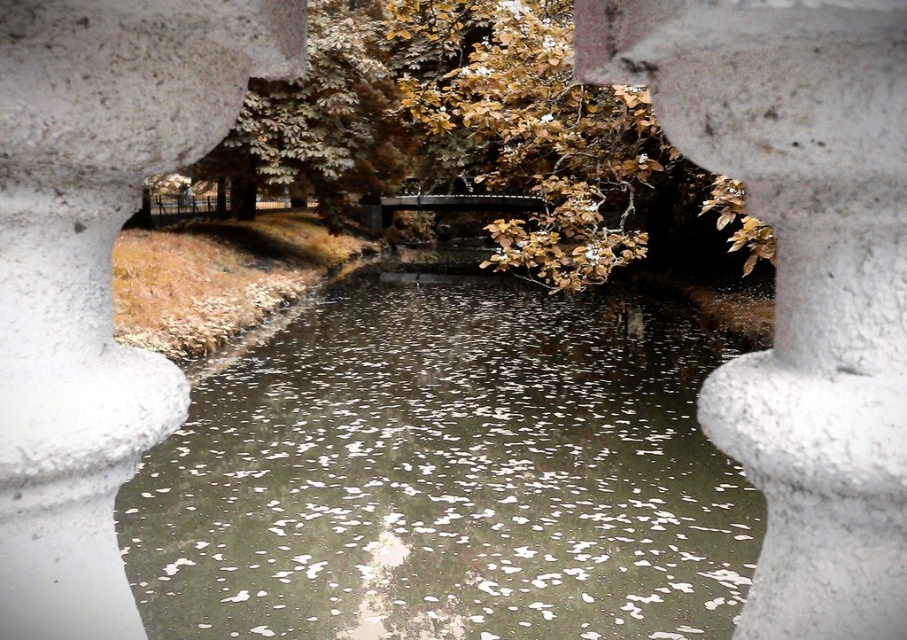
Question: Is white textured pillar at center below white stone pillar at center?

Choices:
 (A) yes
 (B) no

Answer: (B)

Question: Which point appears farthest from the camera in this image?

Choices:
 (A) (870, 49)
 (B) (74, 173)

Answer: (B)

Question: Which of the following is the closest to the observer?

Choices:
 (A) white textured pillar at center
 (B) greenish reflective water at center
 (C) white stone pillar at center

Answer: (A)

Question: Which point appears closest to the camera in this image?

Choices:
 (A) (290, 368)
 (B) (13, 35)
 (C) (588, 64)

Answer: (B)

Question: In this image, where is greenish reflective water at center located relative to white textured pillar at center?

Choices:
 (A) right
 (B) left

Answer: (A)

Question: Does greenish reflective water at center have a larger size compared to white stone pillar at center?

Choices:
 (A) no
 (B) yes

Answer: (B)